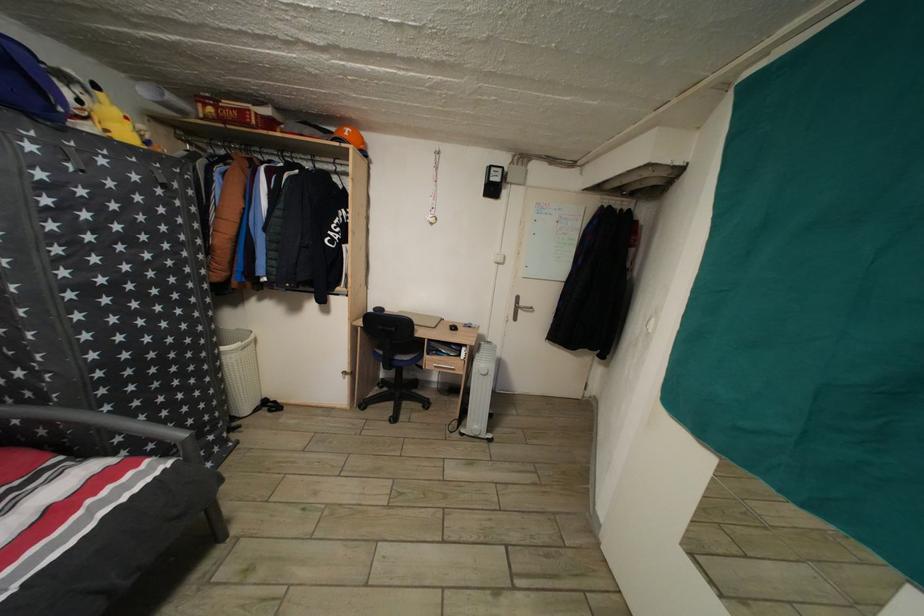
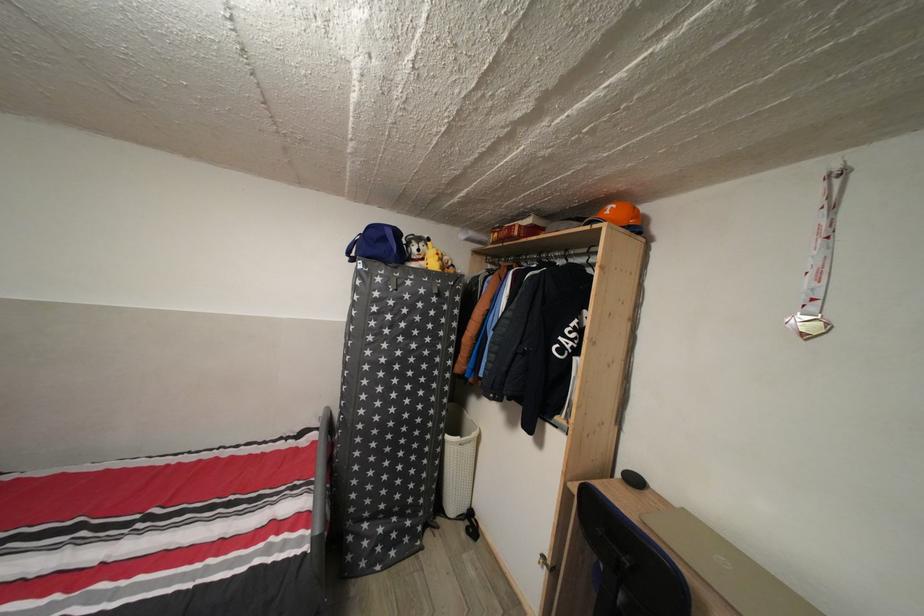
The point at (354, 140) is marked in the first image. Where is the corresponding point in the second image?

(614, 219)